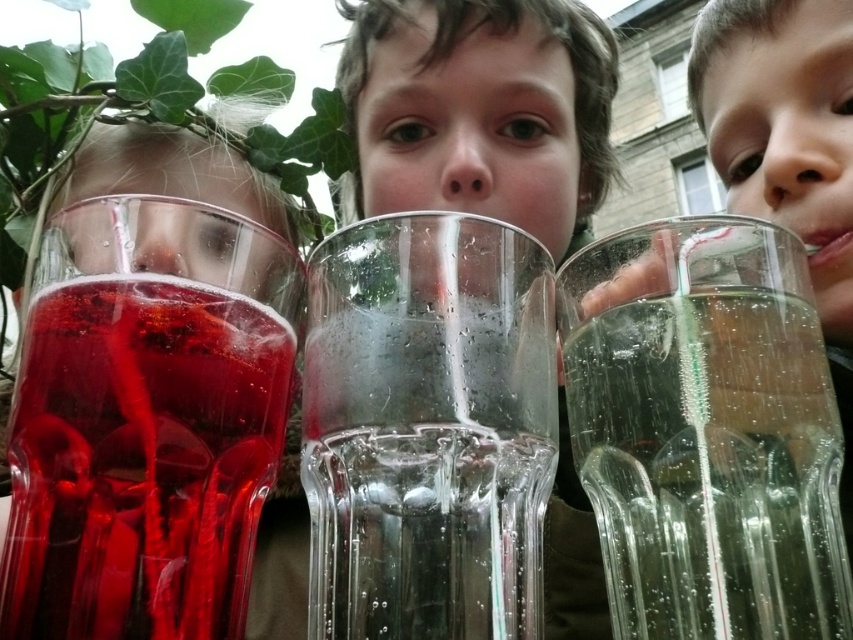
Question: Is matte glass juice at left behind clear glass at center?

Choices:
 (A) yes
 (B) no

Answer: (A)

Question: Among these objects, which one is farthest from the camera?

Choices:
 (A) transparent glass cup at center
 (B) clear glass straw at upper center
 (C) clear glass at center

Answer: (B)

Question: Considering the real-world distances, which object is closest to the transparent glass cup at center?

Choices:
 (A) clear glass at center
 (B) matte glass juice at left
 (C) clear glass straw at upper center

Answer: (A)

Question: From the image, what is the correct spatial relationship of transparent glass cup at center in relation to clear glass at center?

Choices:
 (A) left
 (B) right

Answer: (A)

Question: Is matte glass juice at left closer to camera compared to clear glass straw at upper center?

Choices:
 (A) no
 (B) yes

Answer: (B)

Question: Among these points, which one is farthest from the camera?

Choices:
 (A) (349, 230)
 (B) (357, 634)

Answer: (A)